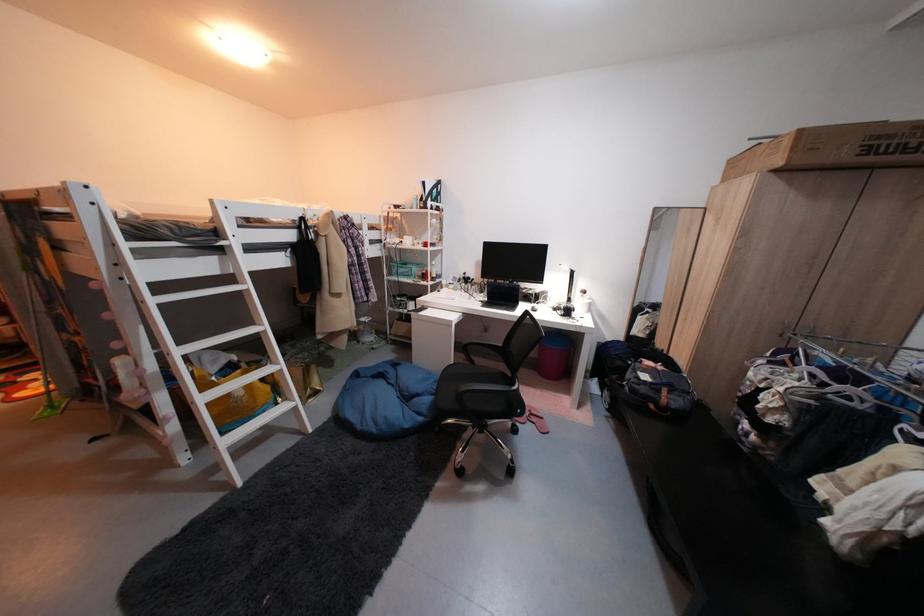
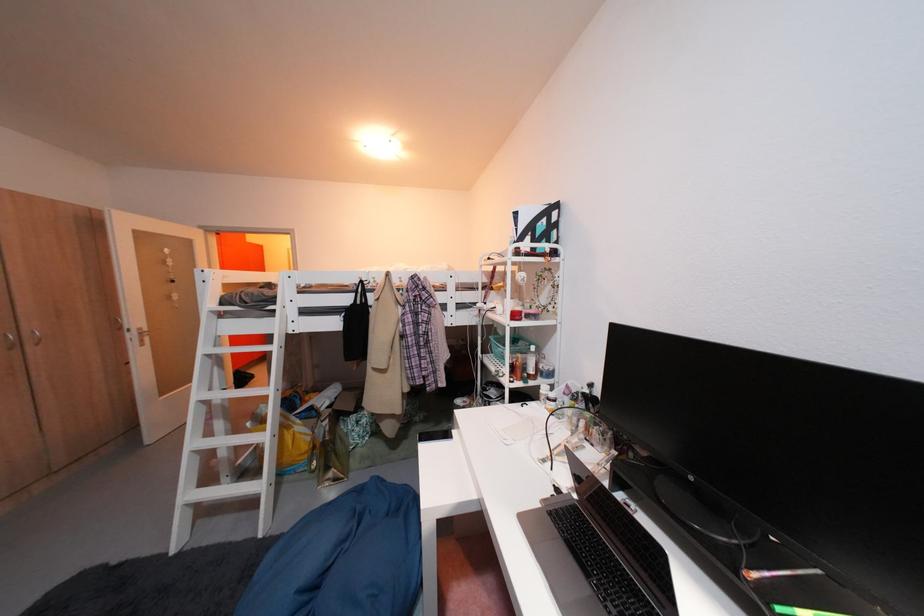
Where in the second image is the point corresponding to [419,278] from the first image?

(514, 363)